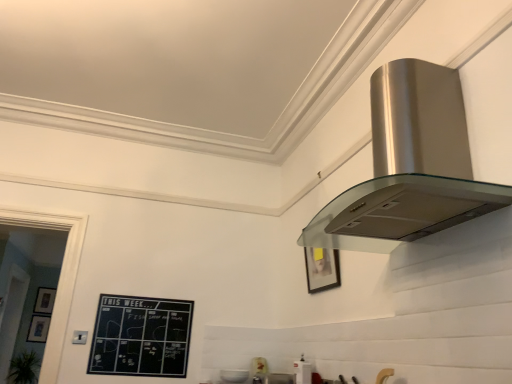
Question: In terms of height, does matte black picture frame at lower left, which is the 1th picture frame in left-to-right order, look taller or shorter compared to satin silver range hood at upper right, which appears as the first appliance when viewed from the left?

Choices:
 (A) tall
 (B) short

Answer: (A)

Question: Would you say matte black picture frame at lower left, which is the 1th picture frame in left-to-right order, is inside or outside satin silver range hood at upper right, the 2th appliance viewed from the front?

Choices:
 (A) outside
 (B) inside

Answer: (A)

Question: Based on their relative distances, which object is farther from the satin silver range hood at upper right, the 2th appliance viewed from the front?

Choices:
 (A) matte black picture frame at lower left, placed as the 2th picture frame when sorted from front to back
 (B) satin silver range hood at upper right
 (C) satin silver range hood at upper right, which is the first appliance from right to left
 (D) matte white toaster at lower center, which appears as the third appliance when viewed from the front
 (E) matte black picture frame at lower left, marked as the 2th picture frame in a bottom-to-top arrangement

Answer: (A)

Question: Which object is positioned farthest from the black chalkboard at lower left?

Choices:
 (A) matte black picture frame at lower left, the 3th picture frame viewed from the right
 (B) matte white toaster at lower center, placed as the 1th appliance when sorted from back to front
 (C) satin silver range hood at upper right
 (D) satin silver range hood at upper right, which is counted as the third appliance, starting from the right
 (E) matte black picture frame at lower left, marked as the 2th picture frame in a bottom-to-top arrangement

Answer: (A)